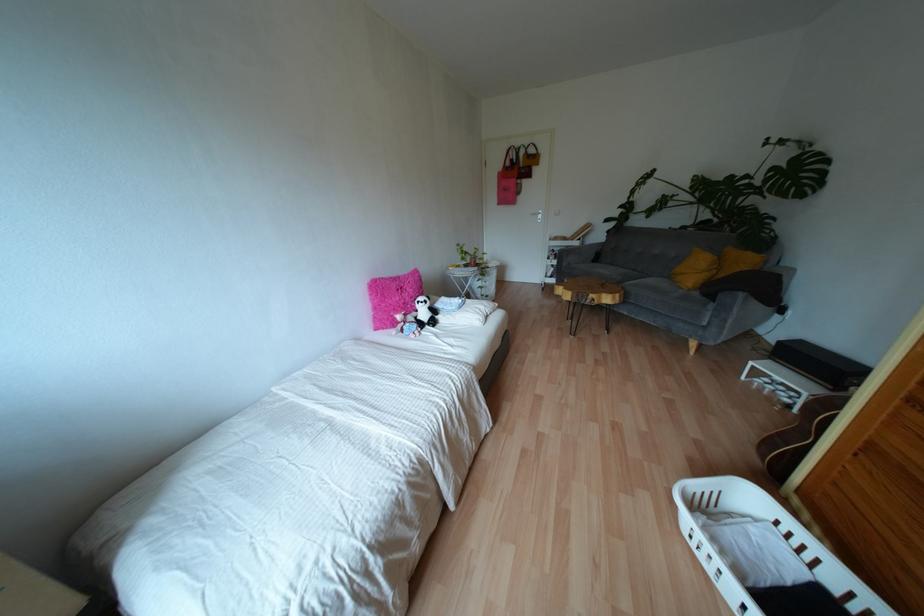
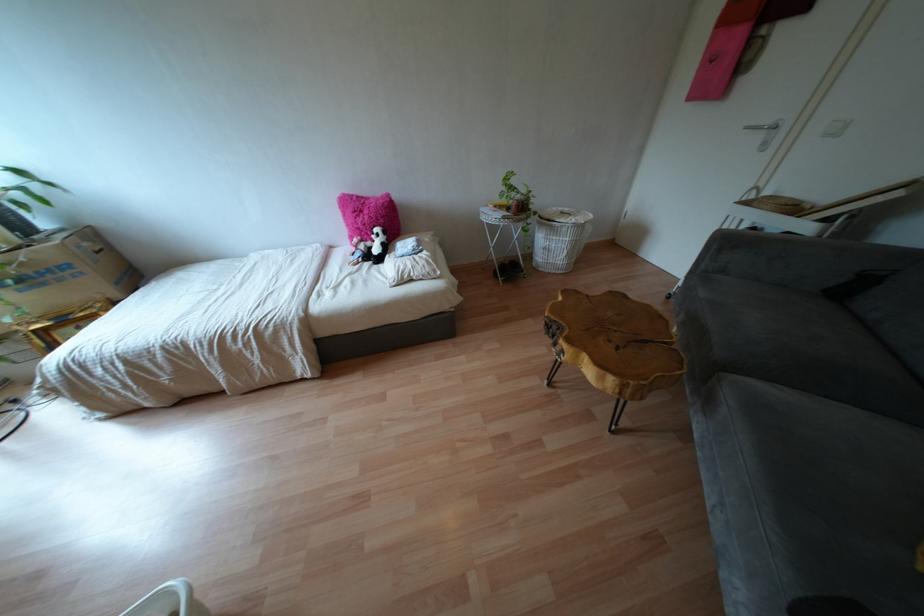
Question: I am providing you with two images of the same scene from different viewpoints. Please identify which objects are invisible in image2.

Choices:
 (A) white pillow
 (B) panda stuffed animal
 (C) wicker tray
 (D) none of these

Answer: (D)